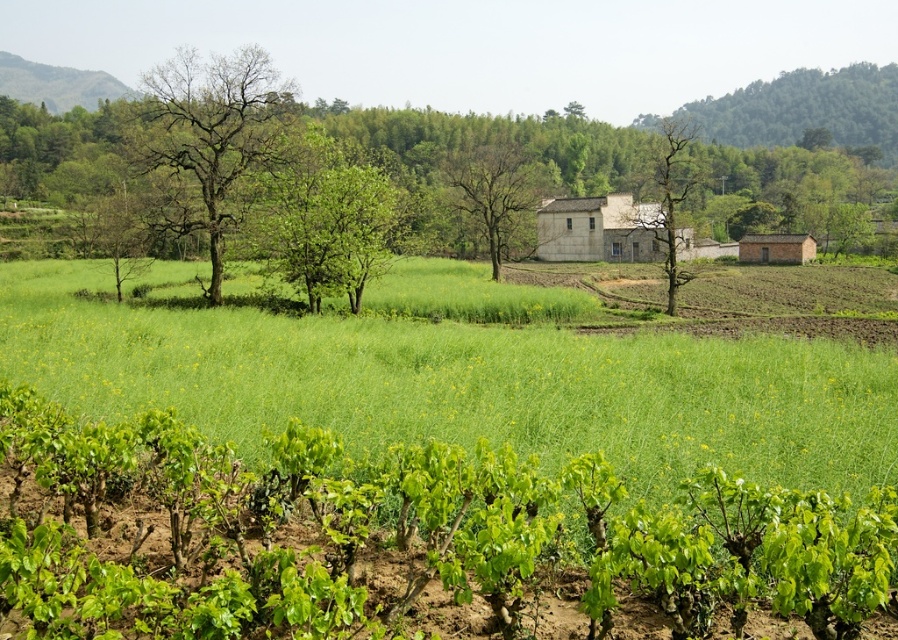
Question: Observing the image, what is the correct spatial positioning of green leafy tree at center in reference to green grassy hillside at upper left?

Choices:
 (A) right
 (B) left

Answer: (A)

Question: Does green grass at center have a greater width compared to white concrete hut at center?

Choices:
 (A) no
 (B) yes

Answer: (B)

Question: Is green leafy tree at center wider than bare wood tree at center?

Choices:
 (A) yes
 (B) no

Answer: (B)

Question: Which point is closer to the camera taking this photo?

Choices:
 (A) (177, 124)
 (B) (544, 173)

Answer: (A)

Question: Which of the following is the closest to the observer?

Choices:
 (A) (785, 260)
 (B) (646, 220)
 (C) (66, 77)
 (D) (500, 150)

Answer: (B)

Question: Which object is farther from the camera taking this photo?

Choices:
 (A) bare branches at left
 (B) bare wood tree at center

Answer: (B)